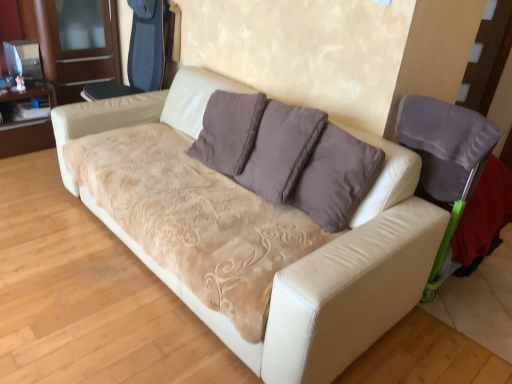
Question: Is brushed wood dresser at left positioned with its back to white leather couch at center?

Choices:
 (A) no
 (B) yes

Answer: (A)

Question: Could you tell me if brushed wood dresser at left is facing white leather couch at center?

Choices:
 (A) yes
 (B) no

Answer: (A)

Question: From the image's perspective, is brushed wood dresser at left under white leather couch at center?

Choices:
 (A) yes
 (B) no

Answer: (B)

Question: From a real-world perspective, is brushed wood dresser at left over white leather couch at center?

Choices:
 (A) no
 (B) yes

Answer: (B)

Question: Can you confirm if brushed wood dresser at left is bigger than white leather couch at center?

Choices:
 (A) yes
 (B) no

Answer: (B)

Question: Considering the relative positions of brushed wood dresser at left and white leather couch at center in the image provided, is brushed wood dresser at left behind white leather couch at center?

Choices:
 (A) no
 (B) yes

Answer: (B)

Question: Is velvet purple armchair at right, which is the second armchair in back-to-front order, to the right of dark blue fabric armchair at upper left, which is the first armchair in back-to-front order, from the viewer's perspective?

Choices:
 (A) no
 (B) yes

Answer: (B)

Question: Is velvet purple armchair at right, the first armchair viewed from the front, shorter than dark blue fabric armchair at upper left, marked as the first armchair in a left-to-right arrangement?

Choices:
 (A) yes
 (B) no

Answer: (A)

Question: Can we say velvet purple armchair at right, the first armchair viewed from the front, lies outside dark blue fabric armchair at upper left, marked as the first armchair in a left-to-right arrangement?

Choices:
 (A) no
 (B) yes

Answer: (B)

Question: Could dark blue fabric armchair at upper left, which is counted as the 2th armchair, starting from the bottom, be considered to be inside velvet purple armchair at right, the 2th armchair viewed from the top?

Choices:
 (A) yes
 (B) no

Answer: (B)

Question: Is velvet purple armchair at right, the first armchair viewed from the front, far from dark blue fabric armchair at upper left, positioned as the second armchair in front-to-back order?

Choices:
 (A) no
 (B) yes

Answer: (B)

Question: Does velvet purple armchair at right, the first armchair viewed from the front, have a smaller size compared to dark blue fabric armchair at upper left, which is the second armchair in right-to-left order?

Choices:
 (A) no
 (B) yes

Answer: (B)

Question: From the image's perspective, is brushed wood dresser at left on velvet purple armchair at right, the second armchair positioned from the left?

Choices:
 (A) yes
 (B) no

Answer: (A)